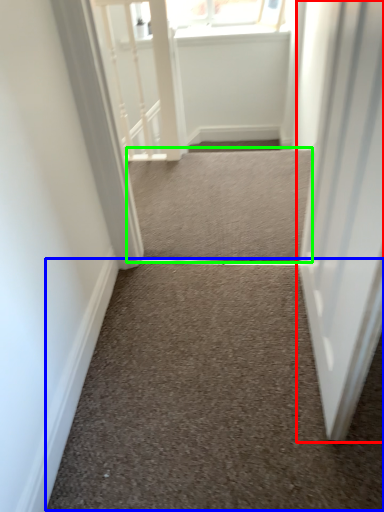
Question: Based on their relative distances, which object is farther from door (highlighted by a red box)? Choose from stairwell (highlighted by a blue box) and stairwell (highlighted by a green box).

Choices:
 (A) stairwell
 (B) stairwell

Answer: (B)